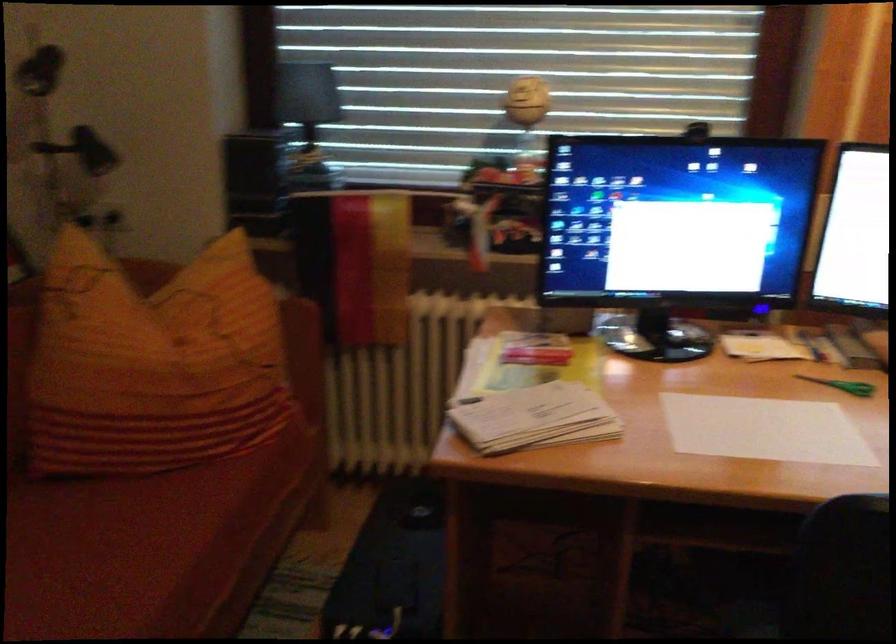
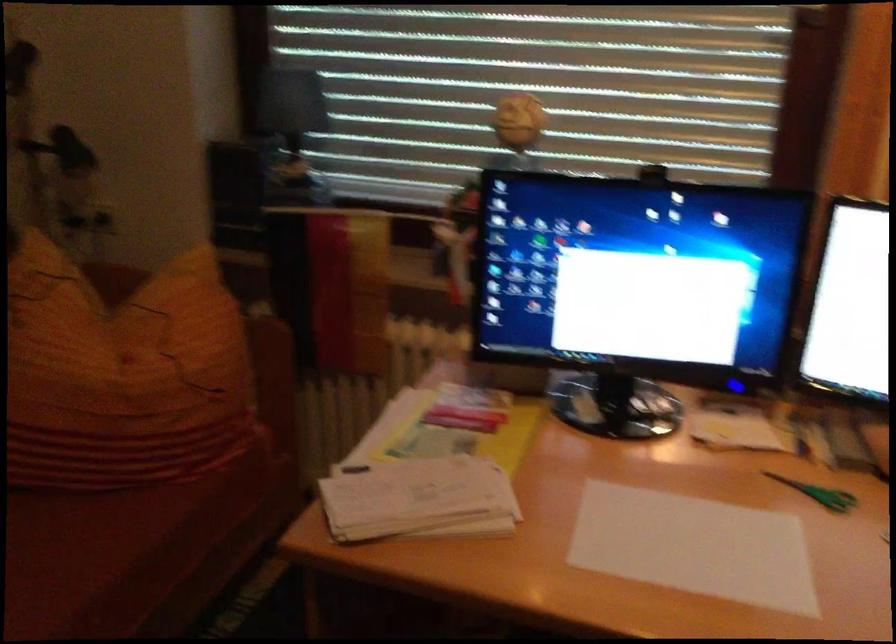
The point at (x=184, y=353) is marked in the first image. Where is the corresponding point in the second image?

(122, 374)